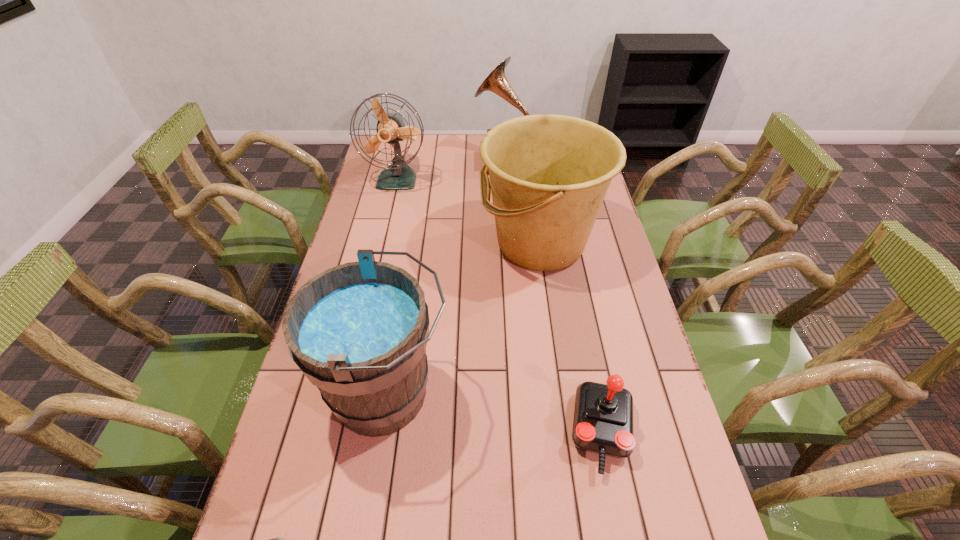
The height and width of the screenshot is (540, 960). Identify the location of object present at the far left corner. (391, 129).

Locate an element on the screen. The image size is (960, 540). blank space at the far edge is located at coordinates (427, 163).

In the image, there is a desktop. At what (x,y) coordinates should I click in order to perform the action: click on vacant space at the left edge. Please return your answer as a coordinate pair (x, y). This screenshot has height=540, width=960. Looking at the image, I should click on (326, 451).

The width and height of the screenshot is (960, 540). I want to click on free region at the right edge of the desktop, so click(x=597, y=285).

Where is `vacant space at the far left corner of the desktop`? The image size is (960, 540). vacant space at the far left corner of the desktop is located at coordinates (412, 146).

The height and width of the screenshot is (540, 960). What are the coordinates of `free point between the joystick and the record player` in the screenshot? It's located at (553, 295).

Find the location of a particular element. The image size is (960, 540). free space between the wine bucket and the bucket is located at coordinates (465, 319).

Point out which object is positioned as the nearest to the microphone. Please provide its 2D coordinates. Your answer should be formatted as a tuple, i.e. [(x, y)], where the tuple contains the x and y coordinates of a point satisfying the conditions above.

[(358, 331)]

Identify which object is located as the fifth nearest to the record player. Please provide its 2D coordinates. Your answer should be formatted as a tuple, i.e. [(x, y)], where the tuple contains the x and y coordinates of a point satisfying the conditions above.

[(279, 539)]